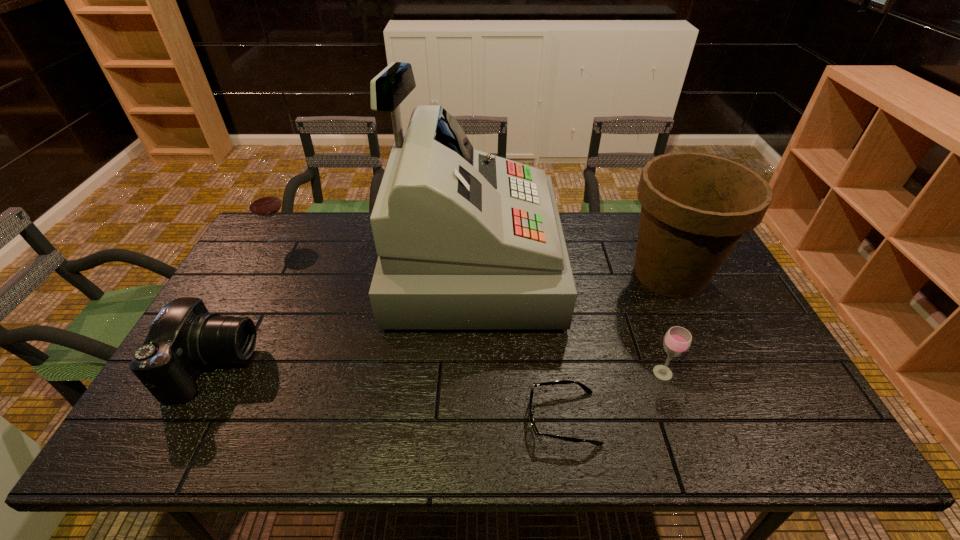
Image resolution: width=960 pixels, height=540 pixels. Find the location of `wineglass that is at the left edge`. wineglass that is at the left edge is located at coordinates (264, 202).

Identify the location of camera at the left edge. (184, 337).

Image resolution: width=960 pixels, height=540 pixels. Find the location of `object that is positioned at the right edge`. object that is positioned at the right edge is located at coordinates (695, 207).

Locate an element on the screen. The height and width of the screenshot is (540, 960). object present at the far left corner is located at coordinates [264, 202].

Locate an element on the screen. The height and width of the screenshot is (540, 960). object that is at the far right corner is located at coordinates (695, 207).

The width and height of the screenshot is (960, 540). In the image, there is a desktop. Identify the location of vacant space at the far edge. (321, 224).

This screenshot has height=540, width=960. In order to click on vacant space at the near edge in this screenshot , I will do `click(670, 441)`.

You are a GUI agent. You are given a task and a screenshot of the screen. Output one action in this format:
    pyautogui.click(x=<x>, y=<y>)
    Task: Click on the free space at the right edge
    The image size is (960, 540).
    Given the screenshot: What is the action you would take?
    pyautogui.click(x=734, y=327)

Where is `free space at the far left corner of the desktop`? The width and height of the screenshot is (960, 540). free space at the far left corner of the desktop is located at coordinates (265, 247).

In the image, there is a desktop. Where is `vacant space at the near right corner`? Image resolution: width=960 pixels, height=540 pixels. vacant space at the near right corner is located at coordinates (814, 439).